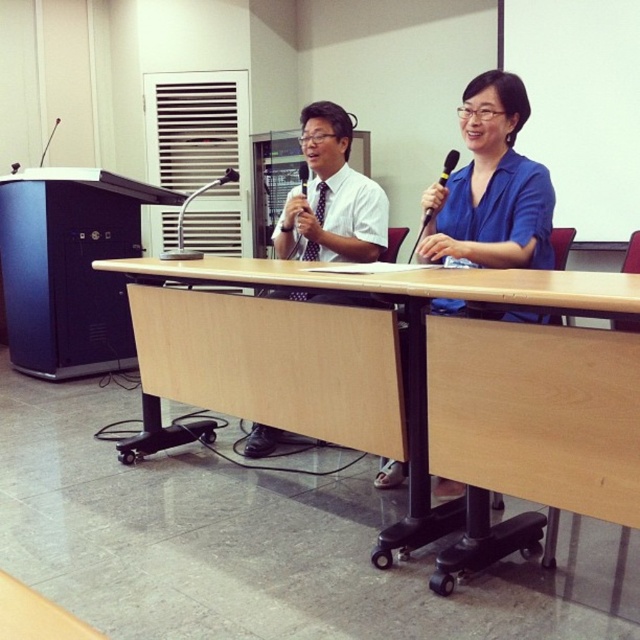
Between blue matte shirt at center and black plastic microphone at center, which one has less height?

black plastic microphone at center is shorter.

Measure the distance between point (380, 477) and camera.

Point (380, 477) is 9.40 feet from camera.

Which is in front, point (490, 109) or point (305, 164)?

Point (490, 109)

Where is `blue matte shirt at center`? The image size is (640, 640). blue matte shirt at center is located at coordinates (492, 186).

The height and width of the screenshot is (640, 640). Describe the element at coordinates (486, 397) in the screenshot. I see `light brown wood table at center` at that location.

Between point (518, 416) and point (490, 147), which one is positioned in front?

Point (518, 416) is in front.

I want to click on light brown wood table at center, so pyautogui.click(x=486, y=397).

Image resolution: width=640 pixels, height=640 pixels. I want to click on white shirt at center, so click(x=332, y=196).

Does white shirt at center have a lesser width compared to black plastic microphone at upper center?

No, white shirt at center is not thinner than black plastic microphone at upper center.

Identify the location of white shirt at center. 332,196.